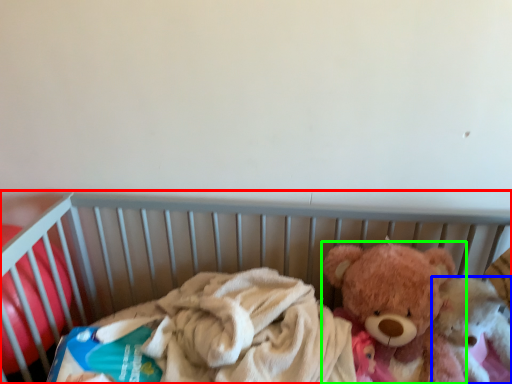
Question: Which object is the closest to the infant bed (highlighted by a red box)? Choose among these: teddy bear (highlighted by a blue box) or teddy bear (highlighted by a green box).

Choices:
 (A) teddy bear
 (B) teddy bear

Answer: (B)